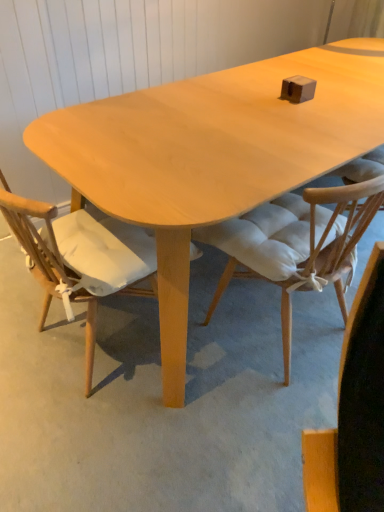
Locate an element on the screen. This screenshot has width=384, height=512. vacant region to the left of light wood chair at center, which is the 2th chair in right-to-left order is located at coordinates (18, 322).